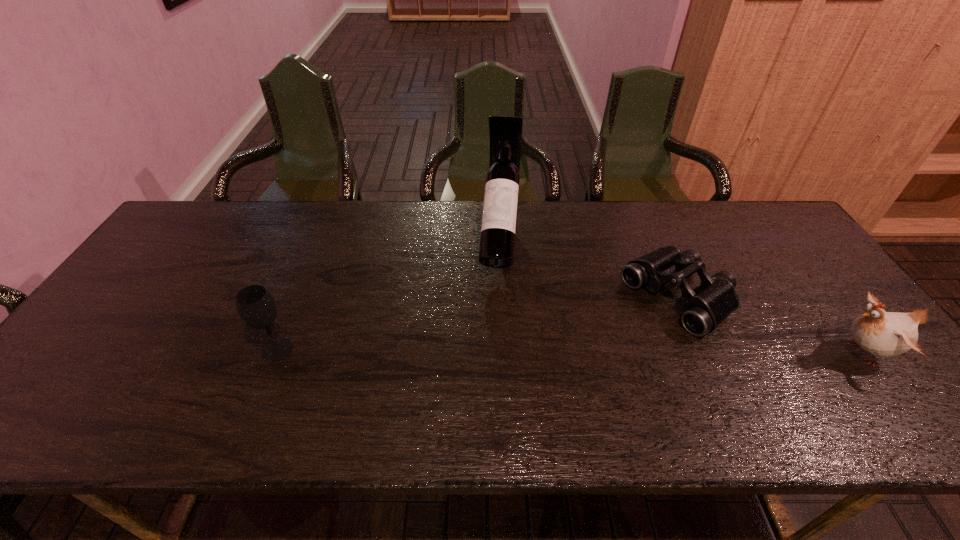
At what (x,y) coordinates should I click in order to perform the action: click on free space between the wine bottle and the wineglass. Please return your answer as a coordinate pair (x, y). Image resolution: width=960 pixels, height=540 pixels. Looking at the image, I should click on (389, 295).

The width and height of the screenshot is (960, 540). What are the coordinates of `vacant region between the third object from left to right and the rightmost object` in the screenshot? It's located at (770, 326).

Identify the location of free spot between the wineglass and the third object from right to left. The width and height of the screenshot is (960, 540). (389, 295).

Where is `free area in between the leftmost object and the second object from right to left`? The height and width of the screenshot is (540, 960). free area in between the leftmost object and the second object from right to left is located at coordinates (478, 324).

Locate an element on the screen. blank region between the wineglass and the bird is located at coordinates (569, 351).

Choose which object is the nearest neighbor to the tallest object. Please provide its 2D coordinates. Your answer should be formatted as a tuple, i.e. [(x, y)], where the tuple contains the x and y coordinates of a point satisfying the conditions above.

[(703, 309)]

Select which object appears as the closest to the bird. Please provide its 2D coordinates. Your answer should be formatted as a tuple, i.e. [(x, y)], where the tuple contains the x and y coordinates of a point satisfying the conditions above.

[(703, 309)]

In order to click on vacant space that satisfies the following two spatial constraints: 1. on the front side of the bird; 2. at the beak of the tallest object in this screenshot , I will do `click(505, 353)`.

You are a GUI agent. You are given a task and a screenshot of the screen. Output one action in this format:
    pyautogui.click(x=<x>, y=<y>)
    Task: Click on the free point that satisfies the following two spatial constraints: 1. on the front side of the rightmost object; 2. at the beak of the third object from left to right
    
    Given the screenshot: What is the action you would take?
    pyautogui.click(x=703, y=353)

Find the location of a particular element. The image size is (960, 540). free space that satisfies the following two spatial constraints: 1. on the back side of the binoculars; 2. on the left side of the wineglass is located at coordinates point(299,299).